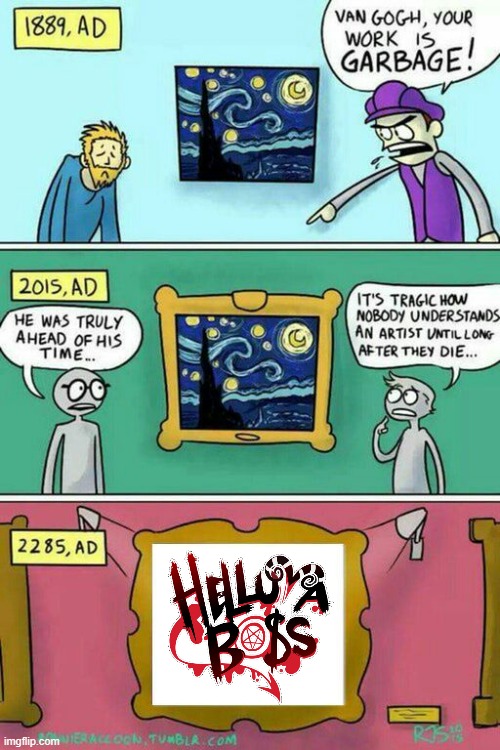
Find the location of `green wall`. green wall is located at coordinates (285, 262).